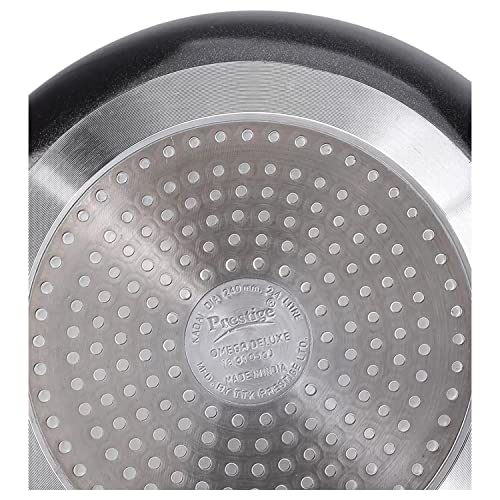
Find the location of a particular element. metal bottom of pan is located at coordinates (252, 336).